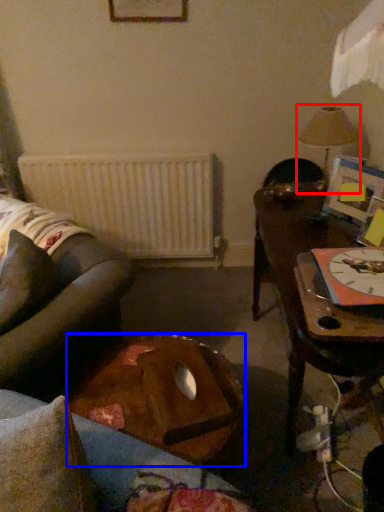
Question: Which object appears farthest to the camera in this image, lamp (highlighted by a red box) or table (highlighted by a blue box)?

Choices:
 (A) lamp
 (B) table

Answer: (A)